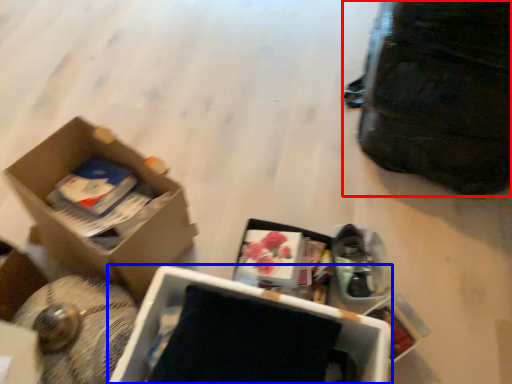
Question: Which object is closer to the camera taking this photo, bag (highlighted by a red box) or box (highlighted by a blue box)?

Choices:
 (A) bag
 (B) box

Answer: (B)